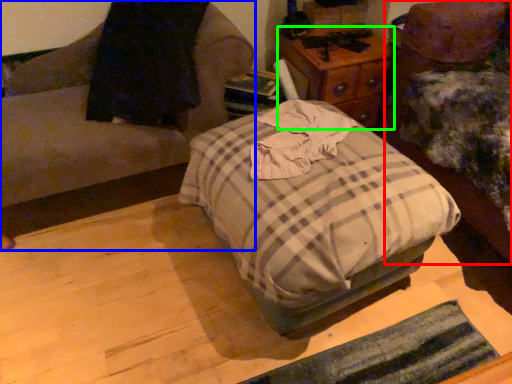
Question: Which object is positioned closest to furniture (highlighted by a red box)? Select from furniture (highlighted by a blue box) and nightstand (highlighted by a green box).

Choices:
 (A) furniture
 (B) nightstand

Answer: (B)